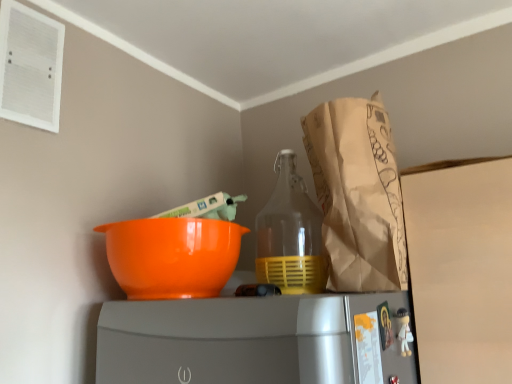
Question: Should I look upward or downward to see white matte figurine at lower right?

Choices:
 (A) up
 (B) down

Answer: (B)